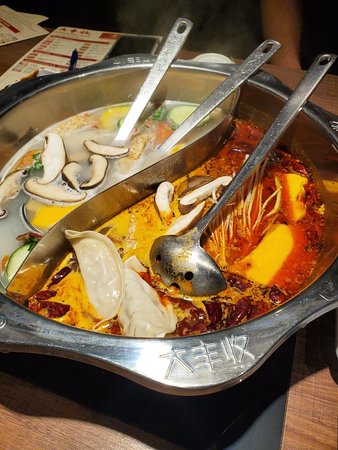
I want to click on bowl, so click(x=102, y=76).